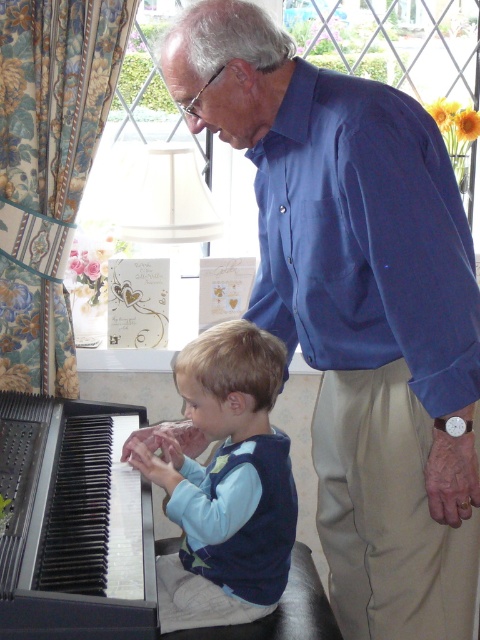
Question: Estimate the real-world distances between objects in this image. Which object is farther from the light blue cotton shirt at center?

Choices:
 (A) blue shirt at upper center
 (B) black plastic piano at lower left

Answer: (A)

Question: Does light blue cotton shirt at center have a greater width compared to black plastic piano at lower left?

Choices:
 (A) yes
 (B) no

Answer: (B)

Question: Is blue shirt at upper center smaller than black plastic piano at lower left?

Choices:
 (A) no
 (B) yes

Answer: (A)

Question: Does blue shirt at upper center have a larger size compared to black plastic piano at lower left?

Choices:
 (A) no
 (B) yes

Answer: (B)

Question: Among these points, which one is farthest from the camera?

Choices:
 (A) (194, 420)
 (B) (287, 292)

Answer: (B)

Question: Which object is the farthest from the black plastic piano at lower left?

Choices:
 (A) light blue cotton shirt at center
 (B) blue shirt at upper center

Answer: (B)